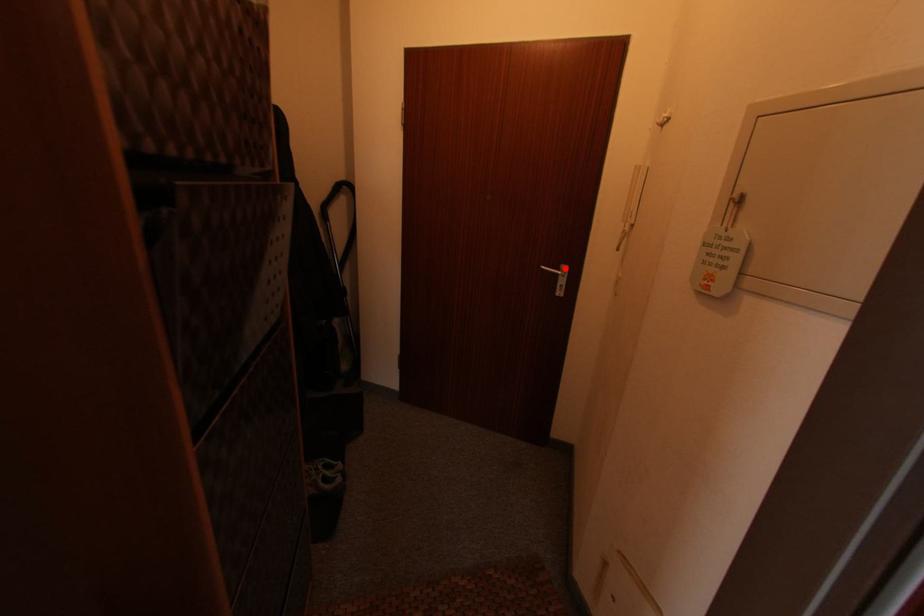
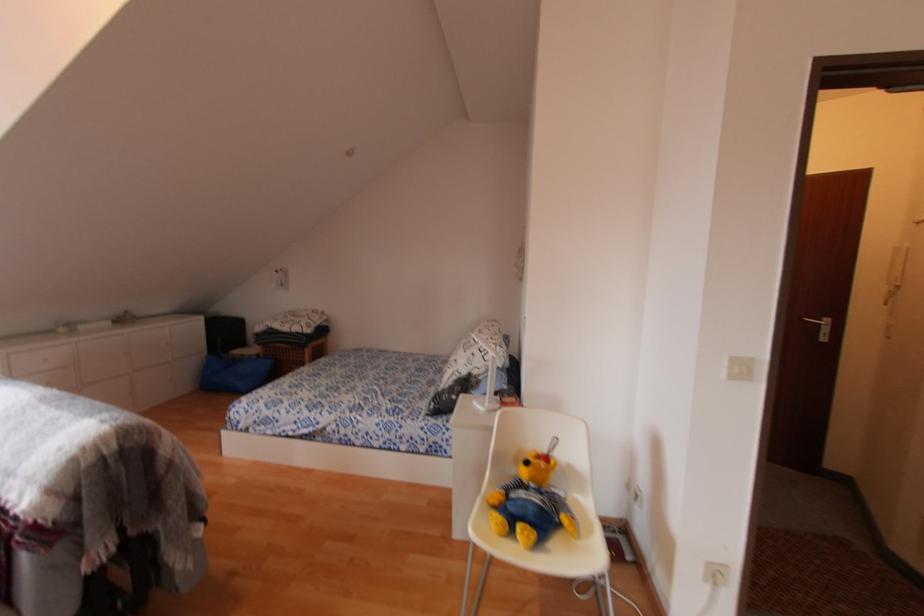
Where in the second image is the point corresponding to the highlighted location from the first image?

(828, 321)